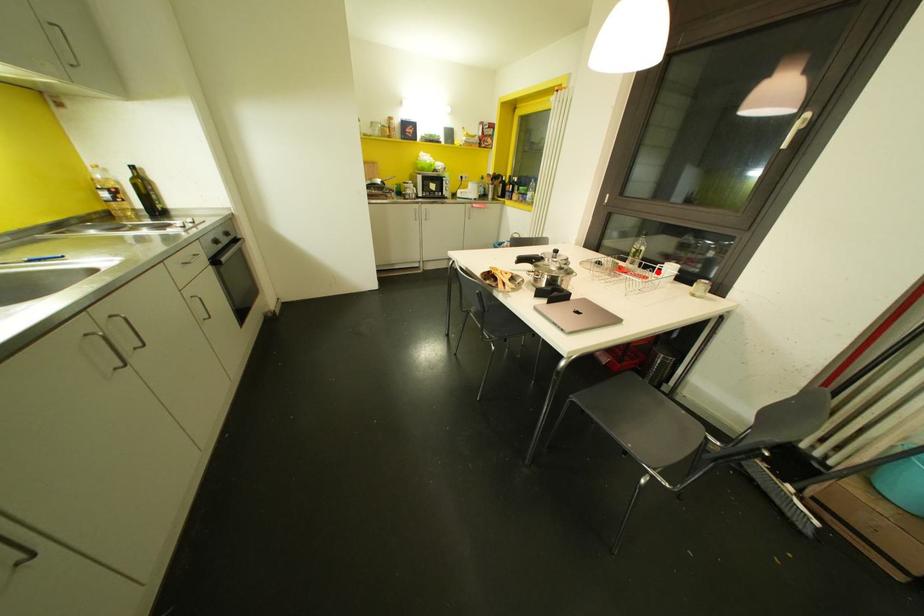
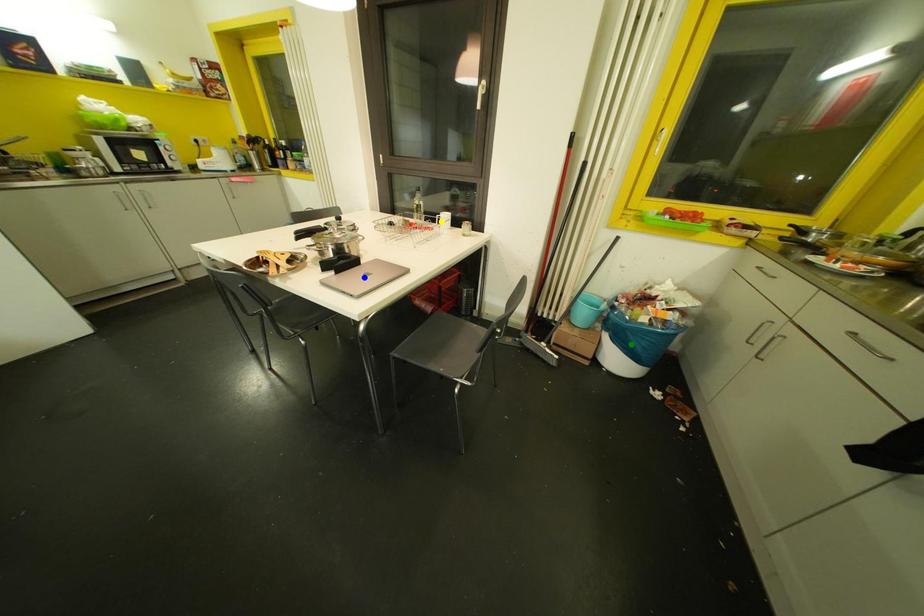
Question: I am providing you with two images of the same scene from different viewpoints. A red point is marked on the first image. You are given multiple points on the second image. In image 2, which mark is for the same physical point as the one in image 1?

Choices:
 (A) yellow point
 (B) green point
 (C) blue point

Answer: (A)